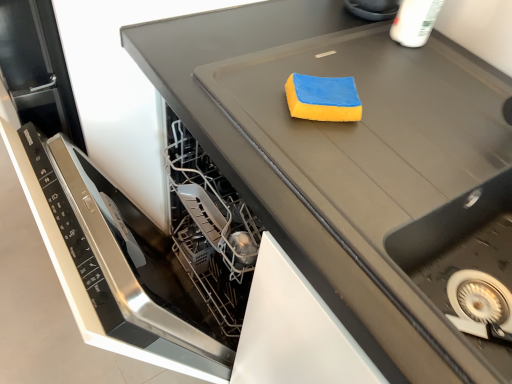
Identify the location of vacant area to the right of blue sponge at center. (422, 114).